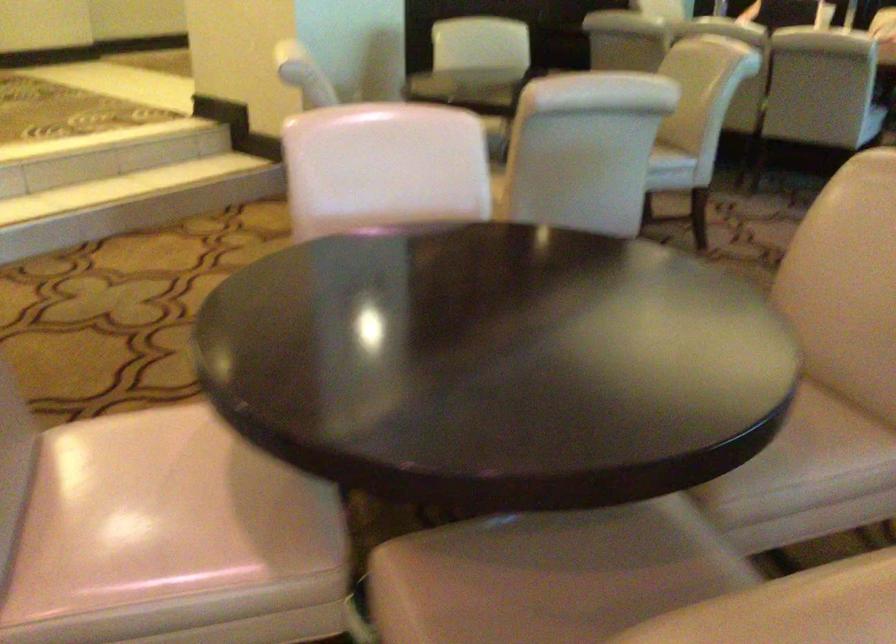
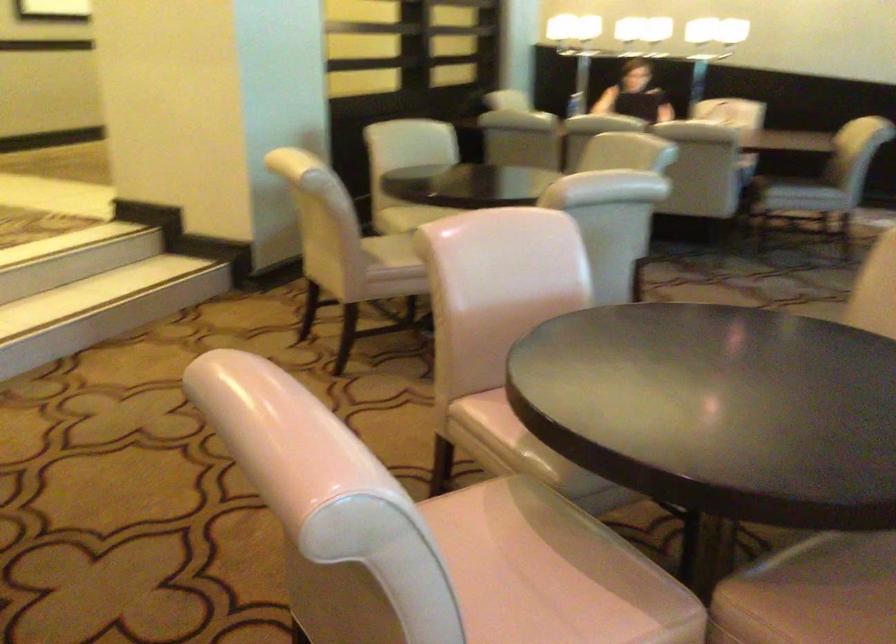
Question: Which direction would the cameraman need to move to produce the second image? Reply with the corresponding letter.

Choices:
 (A) Left
 (B) Right
 (C) Forward
 (D) Backward

Answer: (A)